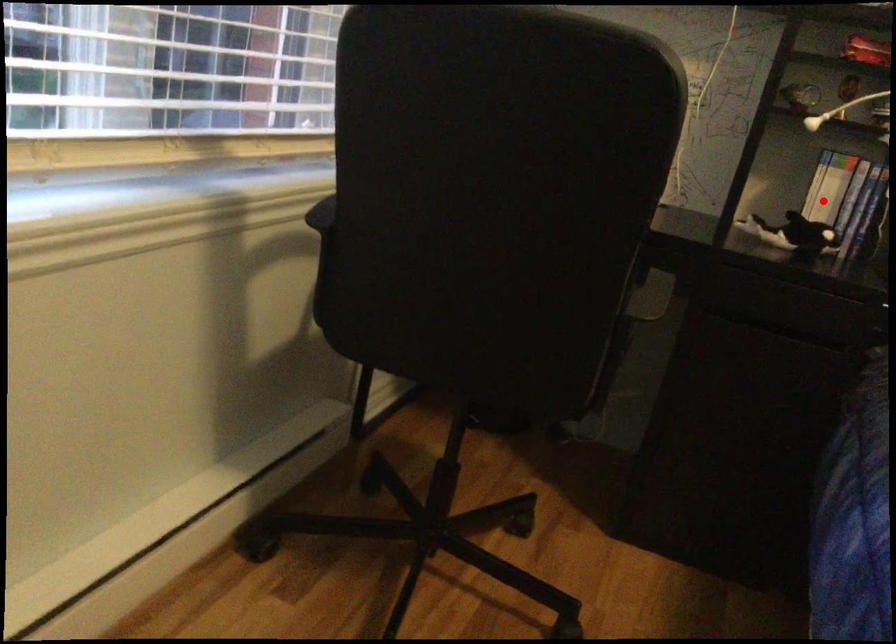
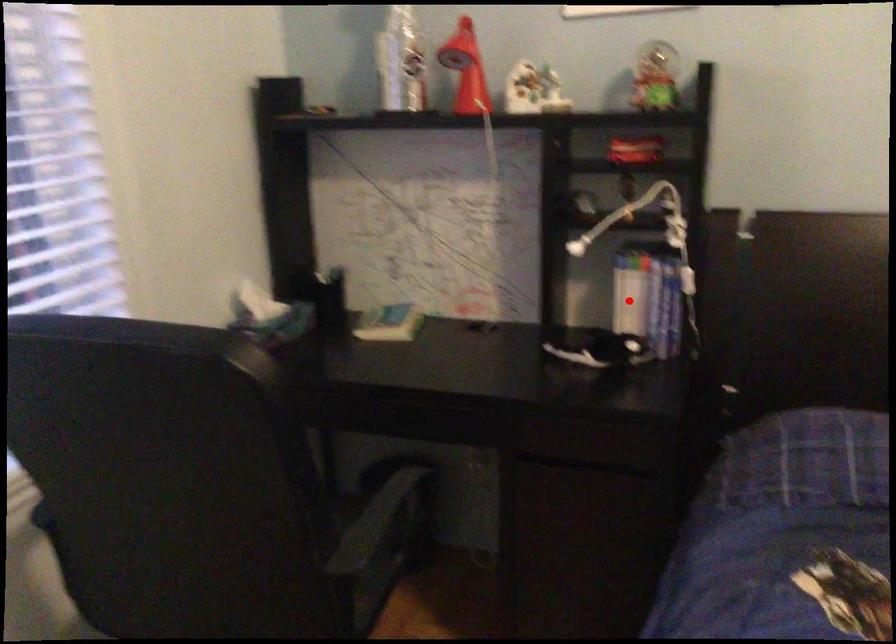
I am providing you with two images of the same scene from different viewpoints. A red point is marked on the first image and another point is marked on the second image. Is the marked point in image1 the same physical position as the marked point in image2?

Yes